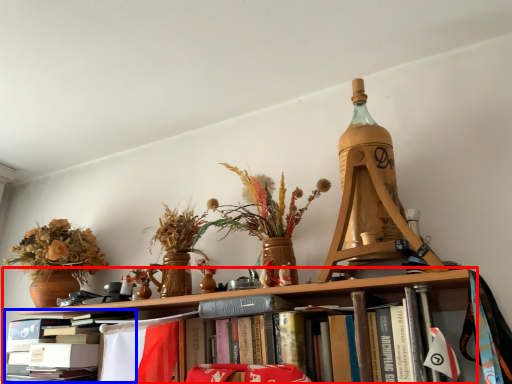
Question: Among these objects, which one is farthest to the camera, shelf (highlighted by a red box) or book (highlighted by a blue box)?

Choices:
 (A) shelf
 (B) book

Answer: (B)